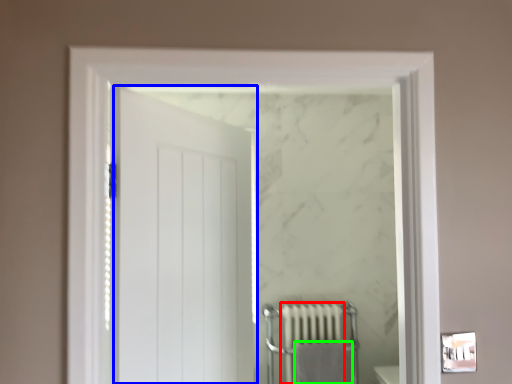
Question: Estimate the real-world distances between objects in this image. Which object is farther from radiator (highlighted by a red box), door (highlighted by a blue box) or bath towel (highlighted by a green box)?

Choices:
 (A) door
 (B) bath towel

Answer: (A)